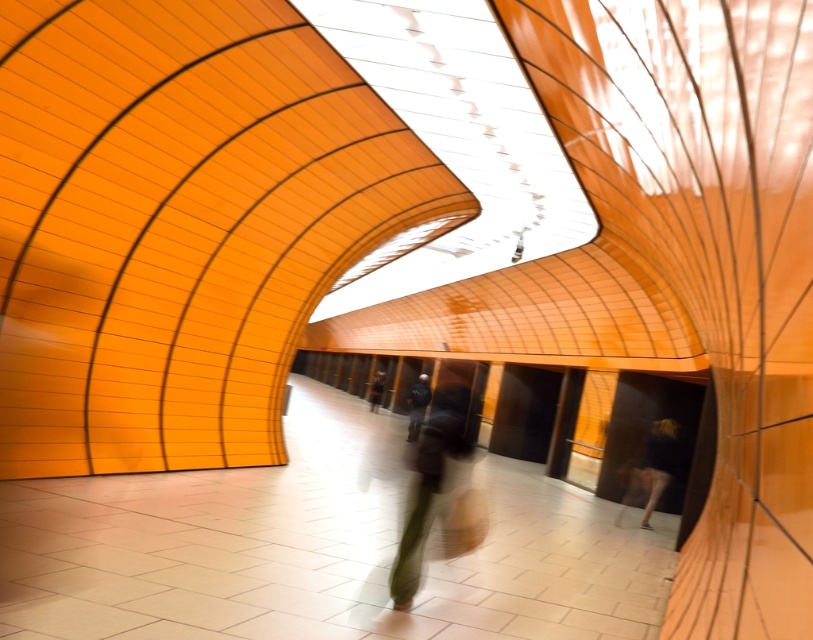
Find the location of a particular element. dark gray fabric bag at center is located at coordinates (429, 484).

Which is in front, point (446, 413) or point (383, 388)?

Point (446, 413)

The width and height of the screenshot is (813, 640). I want to click on dark gray fabric bag at center, so [x=429, y=484].

Between dark gray fabric bag at center and dark blue fabric at lower right, which one has less height?

Standing shorter between the two is dark blue fabric at lower right.

Does dark gray fabric bag at center appear on the left side of dark blue fabric at lower right?

Indeed, dark gray fabric bag at center is positioned on the left side of dark blue fabric at lower right.

Describe the element at coordinates (429, 484) in the screenshot. I see `dark gray fabric bag at center` at that location.

This screenshot has height=640, width=813. I want to click on dark gray fabric bag at center, so click(x=429, y=484).

Is dark blue fabric at lower right shorter than dark blue jeans at center?

Incorrect, dark blue fabric at lower right's height does not fall short of dark blue jeans at center's.

Is dark blue fabric at lower right behind dark blue jeans at center?

No.

Between point (641, 460) and point (381, 387), which one is positioned behind?

The point (381, 387) is more distant.

Locate an element on the screen. The image size is (813, 640). dark blue fabric at lower right is located at coordinates (651, 468).